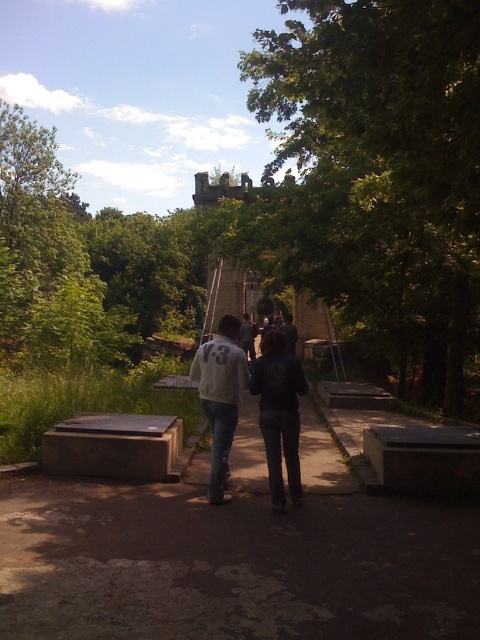
Measure the distance from green leafy tree at upper center to dark gray hoodie at center.

38.24 feet

Which is above, green leafy tree at upper center or dark gray hoodie at center?

Positioned higher is green leafy tree at upper center.

Locate an element on the screen. green leafy tree at upper center is located at coordinates (381, 172).

The height and width of the screenshot is (640, 480). I want to click on white matte jacket at center, so click(220, 396).

Between white matte jacket at center and light gray sweater at center, which one appears on the right side from the viewer's perspective?

From the viewer's perspective, light gray sweater at center appears more on the right side.

Where is `white matte jacket at center`? This screenshot has height=640, width=480. white matte jacket at center is located at coordinates (220, 396).

Who is positioned more to the right, white cotton jacket at center or dark blue jeans at center?

Positioned to the right is dark blue jeans at center.

Which is behind, point (226, 352) or point (262, 355)?

Positioned behind is point (226, 352).

The width and height of the screenshot is (480, 640). I want to click on white cotton jacket at center, so click(x=220, y=396).

Identify the location of white cotton jacket at center. (220, 396).